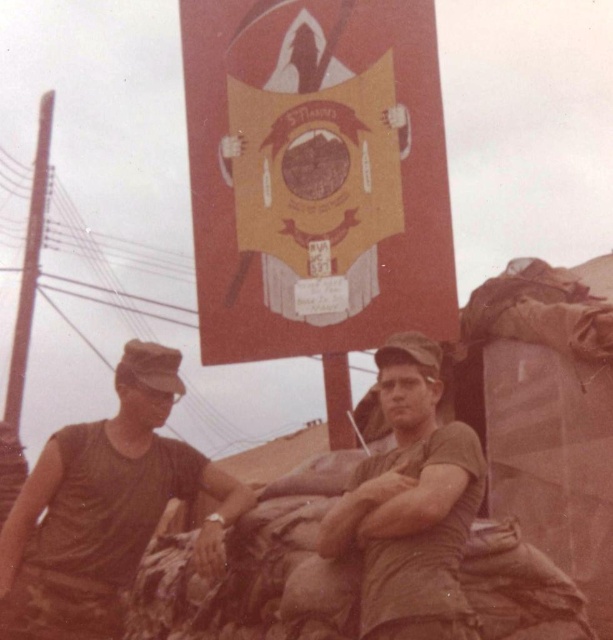
Is camouflage fabric uniform at left below matte green uniform at center?

Correct, camouflage fabric uniform at left is located below matte green uniform at center.

Does camouflage fabric uniform at left have a greater height compared to matte green uniform at center?

Yes, camouflage fabric uniform at left is taller than matte green uniform at center.

The image size is (613, 640). Describe the element at coordinates (105, 508) in the screenshot. I see `camouflage fabric uniform at left` at that location.

The image size is (613, 640). What are the coordinates of `camouflage fabric uniform at left` in the screenshot? It's located at (105, 508).